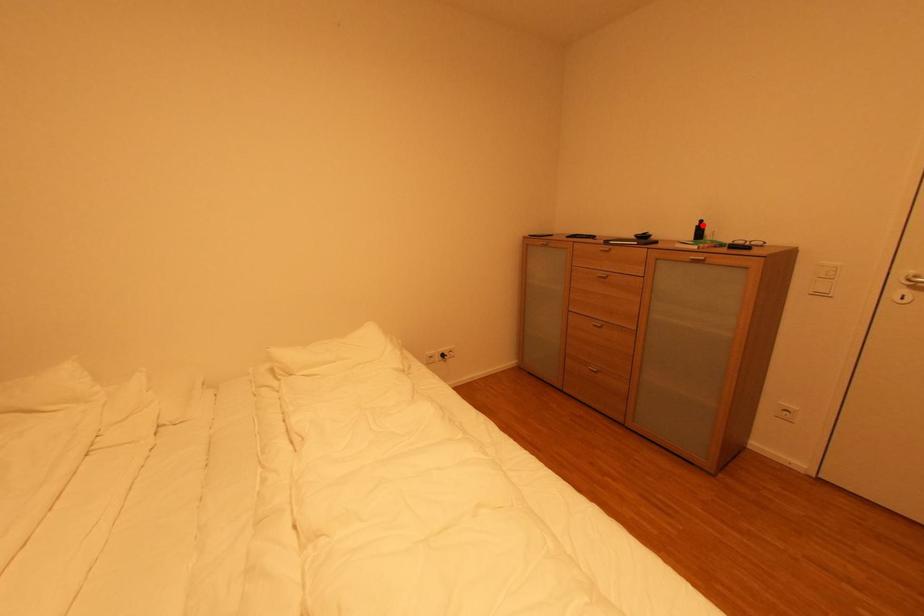
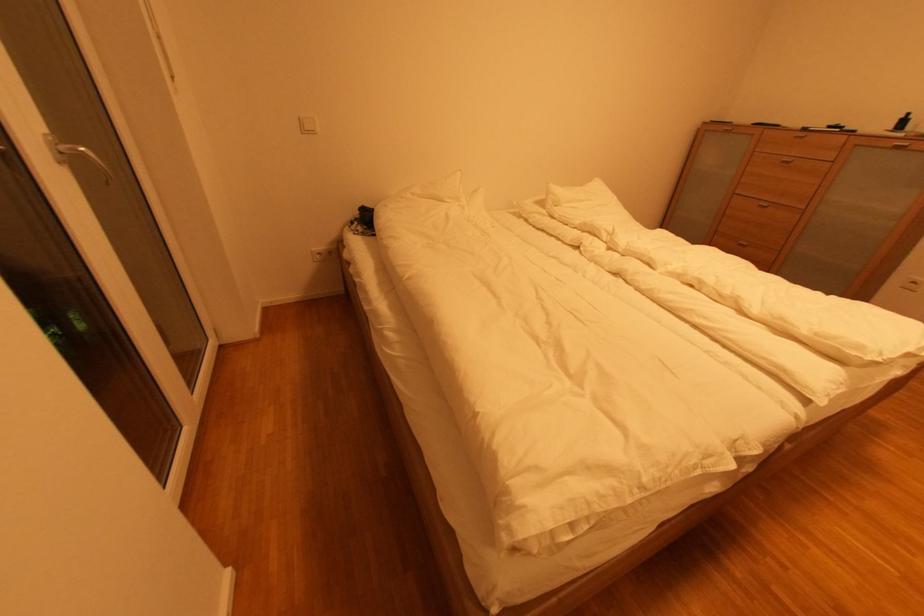
Find the pixel in the second image that matches the highlighted location in the first image.

(908, 118)